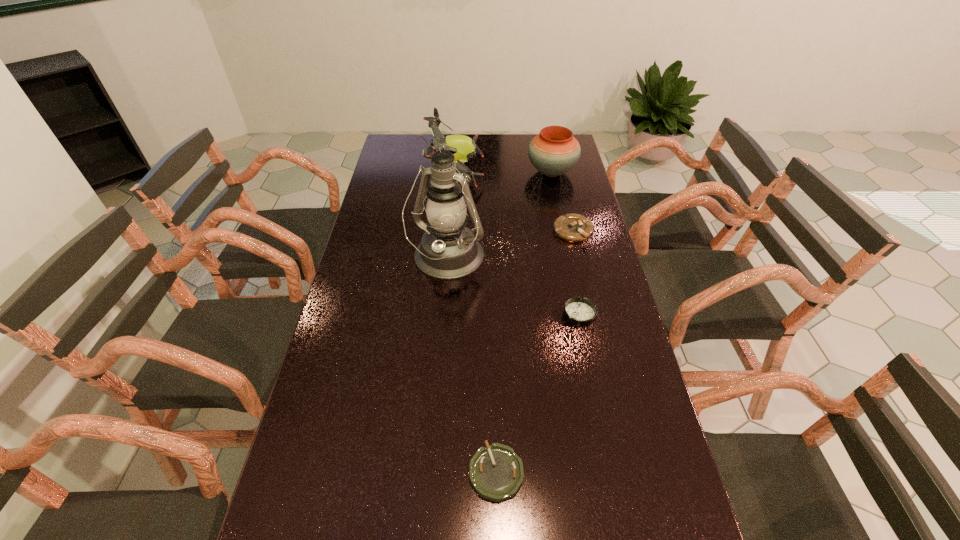
In order to click on free space located 0.140m on the front-facing side of the second tallest object in this screenshot , I will do `click(517, 174)`.

Locate an element on the screen. The image size is (960, 540). vacant region located on the front of the fourth shortest object is located at coordinates (560, 208).

In order to click on free location located 0.100m on the front of the farthest ashtray in this screenshot , I will do `click(581, 265)`.

Locate an element on the screen. The width and height of the screenshot is (960, 540). free space located on the back of the second nearest ashtray is located at coordinates (572, 281).

The width and height of the screenshot is (960, 540). Find the location of `vacant space situated on the left of the shortest ashtray`. vacant space situated on the left of the shortest ashtray is located at coordinates (293, 472).

Where is `drone that is at the far edge`? Image resolution: width=960 pixels, height=540 pixels. drone that is at the far edge is located at coordinates [x=462, y=147].

Where is `pottery located at the far edge`? Image resolution: width=960 pixels, height=540 pixels. pottery located at the far edge is located at coordinates (553, 152).

The width and height of the screenshot is (960, 540). What are the coordinates of `pottery that is at the right edge` in the screenshot? It's located at (553, 152).

Find the location of a particular element. object present at the far right corner is located at coordinates (553, 152).

In the image, there is a desktop. Where is `free space at the far edge`? Image resolution: width=960 pixels, height=540 pixels. free space at the far edge is located at coordinates (525, 146).